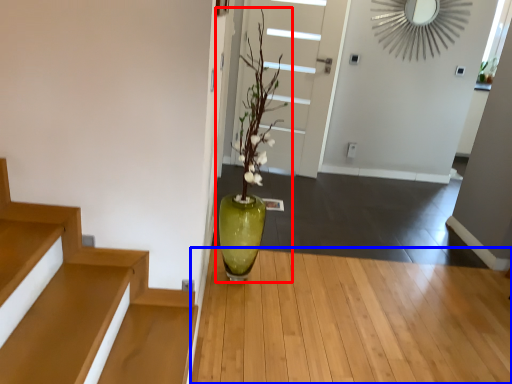
Question: Among these objects, which one is nearest to the camera, houseplant (highlighted by a red box) or hardwood (highlighted by a blue box)?

Choices:
 (A) houseplant
 (B) hardwood

Answer: (B)